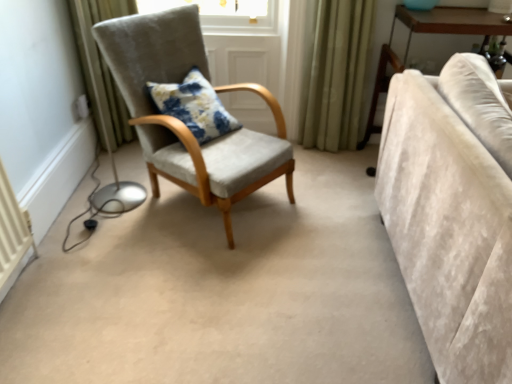
Question: Considering the relative sizes of floral fabric cushion at center and light brown wooden table at right in the image provided, is floral fabric cushion at center thinner than light brown wooden table at right?

Choices:
 (A) yes
 (B) no

Answer: (A)

Question: Is floral fabric cushion at center shorter than light brown wooden table at right?

Choices:
 (A) no
 (B) yes

Answer: (B)

Question: Is floral fabric cushion at center positioned with its back to light brown wooden table at right?

Choices:
 (A) no
 (B) yes

Answer: (A)

Question: Considering the relative sizes of floral fabric cushion at center and light brown wooden table at right in the image provided, is floral fabric cushion at center wider than light brown wooden table at right?

Choices:
 (A) yes
 (B) no

Answer: (B)

Question: From a real-world perspective, is floral fabric cushion at center on light brown wooden table at right?

Choices:
 (A) yes
 (B) no

Answer: (A)

Question: From a real-world perspective, is floral fabric cushion at center above or below suede/grey chair at center?

Choices:
 (A) below
 (B) above

Answer: (A)

Question: Is floral fabric cushion at center spatially inside suede/grey chair at center, or outside of it?

Choices:
 (A) outside
 (B) inside

Answer: (B)

Question: Looking at their shapes, would you say floral fabric cushion at center is wider or thinner than suede/grey chair at center?

Choices:
 (A) thin
 (B) wide

Answer: (A)

Question: In the image, is floral fabric cushion at center positioned in front of or behind suede/grey chair at center?

Choices:
 (A) front
 (B) behind

Answer: (B)

Question: From a real-world perspective, is light brown wooden table at right above or below beige velvet couch at right?

Choices:
 (A) above
 (B) below

Answer: (B)

Question: Considering the positions of light brown wooden table at right and beige velvet couch at right in the image, is light brown wooden table at right taller or shorter than beige velvet couch at right?

Choices:
 (A) short
 (B) tall

Answer: (B)

Question: Considering the positions of light brown wooden table at right and beige velvet couch at right in the image, is light brown wooden table at right wider or thinner than beige velvet couch at right?

Choices:
 (A) thin
 (B) wide

Answer: (A)

Question: Is light brown wooden table at right bigger or smaller than beige velvet couch at right?

Choices:
 (A) big
 (B) small

Answer: (B)

Question: Visually, is floral fabric cushion at center positioned to the left or to the right of light brown wooden table at right?

Choices:
 (A) left
 (B) right

Answer: (A)

Question: Considering their positions, is floral fabric cushion at center located in front of or behind light brown wooden table at right?

Choices:
 (A) front
 (B) behind

Answer: (A)